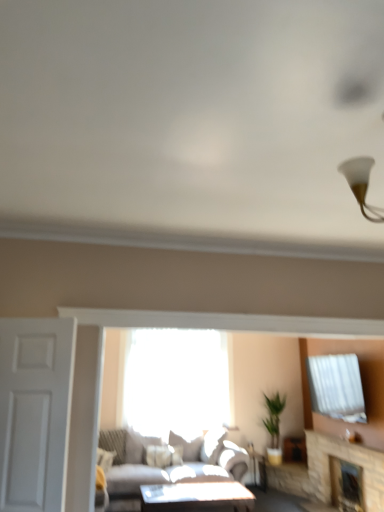
Find the location of a particular element. vacant space situated above matte white table at center (from a real-world perspective) is located at coordinates (203, 490).